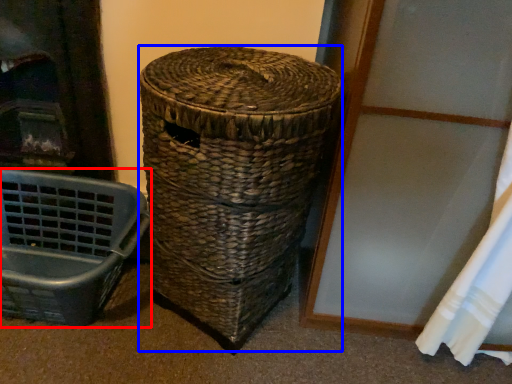
Question: Which object appears closest to the camera in this image, furniture (highlighted by a red box) or basket (highlighted by a blue box)?

Choices:
 (A) furniture
 (B) basket

Answer: (B)